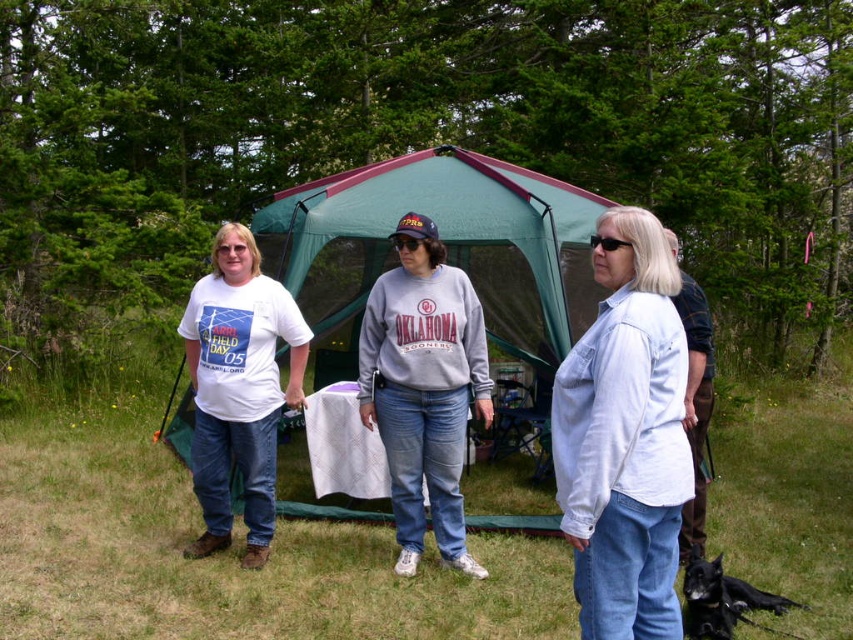
Question: Can you confirm if white matte t-shirt at left is positioned above black matte cap at center?

Choices:
 (A) yes
 (B) no

Answer: (B)

Question: Estimate the real-world distances between objects in this image. Which object is closer to the brown leather pants at right?

Choices:
 (A) black plastic sunglasses at center
 (B) green fabric tent at center
 (C) gray fleece sweatshirt at center

Answer: (C)

Question: Which object is the farthest from the light blue denim jacket at center?

Choices:
 (A) green fabric tent at center
 (B) black matte cap at center
 (C) white matte t-shirt at left

Answer: (A)

Question: Can you confirm if green fabric tent at center is thinner than black matte cap at center?

Choices:
 (A) no
 (B) yes

Answer: (A)

Question: Which point is closer to the camera?

Choices:
 (A) white matte t-shirt at left
 (B) black plastic sunglasses at center

Answer: (B)

Question: Is green fabric tent at center positioned behind light blue denim jacket at center?

Choices:
 (A) no
 (B) yes

Answer: (B)